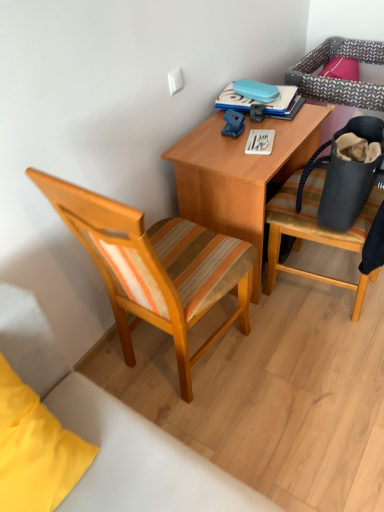
At what (x,y) coordinates should I click in order to perform the action: click on free location in front of woodenchair at left, the first chair positioned from the left. Please return your answer as a coordinate pair (x, y). Looking at the image, I should click on (249, 439).